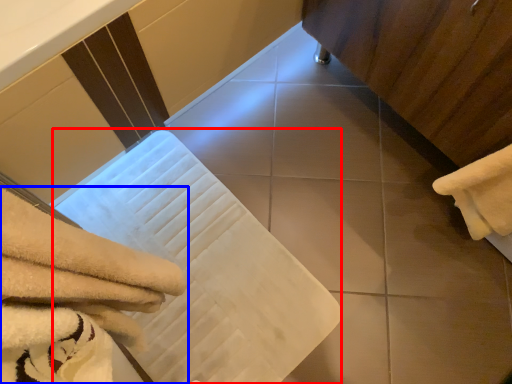
Question: Among these objects, which one is farthest to the camera, bath towel (highlighted by a red box) or towel (highlighted by a blue box)?

Choices:
 (A) bath towel
 (B) towel

Answer: (A)